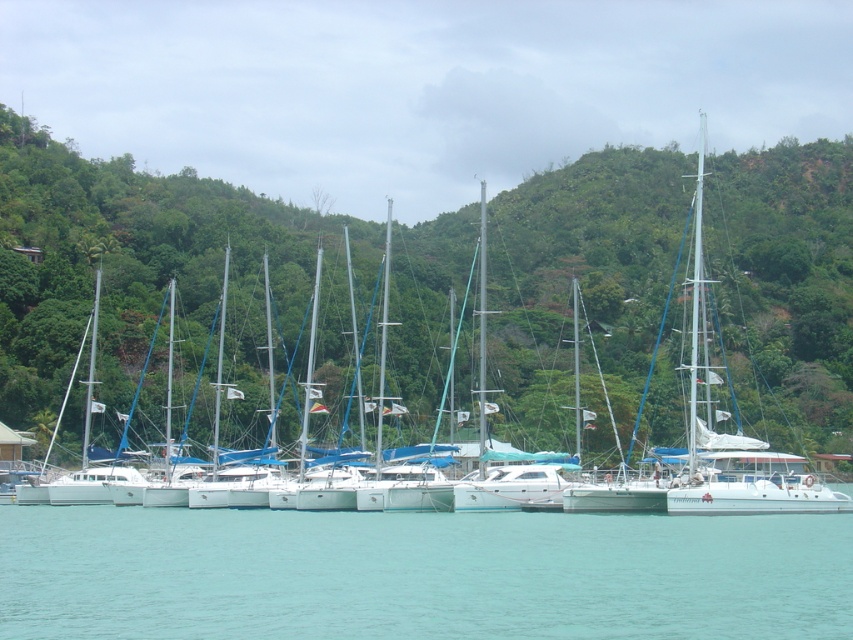
Does green leafy tree at center appear on the right side of clear blue water at lower center?

Correct, you'll find green leafy tree at center to the right of clear blue water at lower center.

Can you confirm if green leafy tree at center is positioned below clear blue water at lower center?

No.

Locate an element on the screen. This screenshot has width=853, height=640. green leafy tree at center is located at coordinates (175, 289).